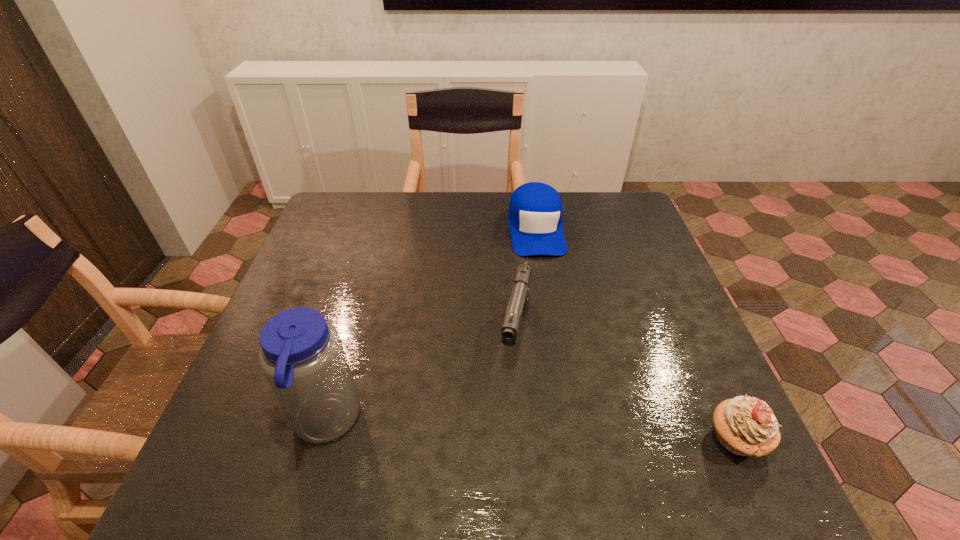
The width and height of the screenshot is (960, 540). In order to click on vacant space at the near edge of the desktop in this screenshot , I will do `click(508, 440)`.

Locate an element on the screen. This screenshot has width=960, height=540. vacant space at the right edge of the desktop is located at coordinates (631, 317).

The height and width of the screenshot is (540, 960). Find the location of `vacant space at the far left corner of the desktop`. vacant space at the far left corner of the desktop is located at coordinates (314, 234).

You are a GUI agent. You are given a task and a screenshot of the screen. Output one action in this format:
    pyautogui.click(x=<x>, y=<y>)
    Task: Click on the free spot between the cupcake and the gun
    The image size is (960, 540).
    Given the screenshot: What is the action you would take?
    pyautogui.click(x=626, y=386)

Where is `empty location between the water bottle and the baseball cap`? Image resolution: width=960 pixels, height=540 pixels. empty location between the water bottle and the baseball cap is located at coordinates (430, 325).

Find the location of `vacant point located between the water bottle and the gun`. vacant point located between the water bottle and the gun is located at coordinates (420, 377).

Locate an element on the screen. blank region between the tallest object and the gun is located at coordinates (420, 377).

Where is `vacant area between the gun and the water bottle`? vacant area between the gun and the water bottle is located at coordinates (420, 377).

Find the location of a particular element. free space between the water bottle and the third nearest object is located at coordinates (420, 377).

The width and height of the screenshot is (960, 540). Identify the location of free area in between the gun and the cupcake. (626, 386).